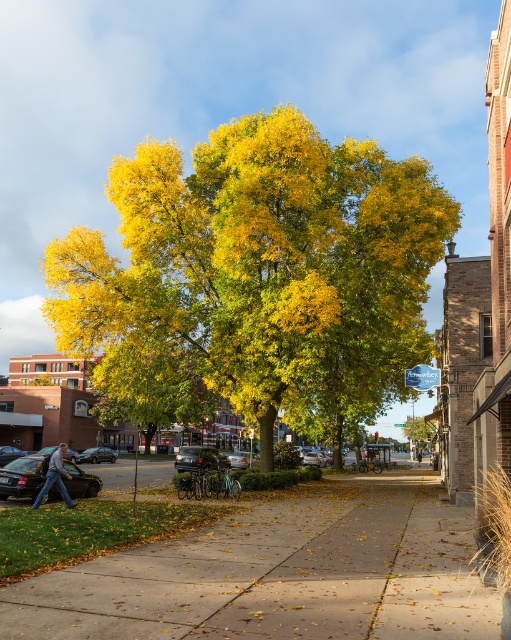
Can you confirm if yellow-green foliage at center is bigger than concrete sidewalk at center?

Indeed, yellow-green foliage at center has a larger size compared to concrete sidewalk at center.

Does yellow-green foliage at center appear on the left side of concrete sidewalk at center?

Correct, you'll find yellow-green foliage at center to the left of concrete sidewalk at center.

Where is `yellow-green foliage at center`? yellow-green foliage at center is located at coordinates (265, 268).